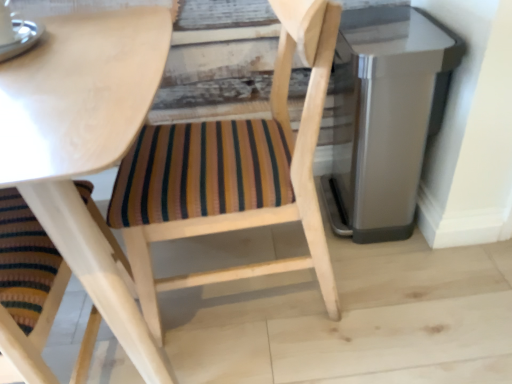
Question: Does satin silver trash can at right have a lesser width compared to wooden chair with striped cushion at center?

Choices:
 (A) no
 (B) yes

Answer: (B)

Question: From a real-world perspective, does satin silver trash can at right sit lower than wooden chair with striped cushion at center?

Choices:
 (A) yes
 (B) no

Answer: (A)

Question: Does satin silver trash can at right appear on the right side of wooden chair with striped cushion at center?

Choices:
 (A) yes
 (B) no

Answer: (A)

Question: Does satin silver trash can at right have a greater width compared to wooden chair with striped cushion at center?

Choices:
 (A) no
 (B) yes

Answer: (A)

Question: Is satin silver trash can at right closer to camera compared to wooden chair with striped cushion at center?

Choices:
 (A) no
 (B) yes

Answer: (A)

Question: Considering the relative sizes of satin silver trash can at right and wooden chair with striped cushion at center in the image provided, is satin silver trash can at right bigger than wooden chair with striped cushion at center?

Choices:
 (A) no
 (B) yes

Answer: (A)

Question: Is wooden chair with striped cushion at center looking in the opposite direction of satin silver trash can at right?

Choices:
 (A) no
 (B) yes

Answer: (B)

Question: Considering the relative positions of wooden chair with striped cushion at center and satin silver trash can at right in the image provided, is wooden chair with striped cushion at center behind satin silver trash can at right?

Choices:
 (A) yes
 (B) no

Answer: (B)

Question: Does wooden chair with striped cushion at center have a lesser height compared to satin silver trash can at right?

Choices:
 (A) no
 (B) yes

Answer: (A)

Question: Is satin silver trash can at right a part of wooden chair with striped cushion at center?

Choices:
 (A) yes
 (B) no

Answer: (B)

Question: From a real-world perspective, does wooden chair with striped cushion at center stand above satin silver trash can at right?

Choices:
 (A) yes
 (B) no

Answer: (A)

Question: From a real-world perspective, is wooden chair with striped cushion at center beneath satin silver trash can at right?

Choices:
 (A) no
 (B) yes

Answer: (A)

Question: Relative to wooden chair with striped cushion at center, is satin silver trash can at right in front or behind?

Choices:
 (A) behind
 (B) front

Answer: (A)